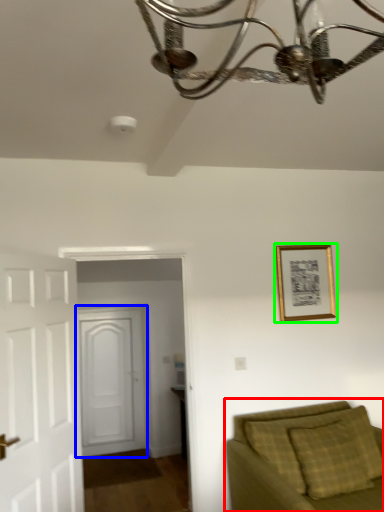
Question: Based on their relative distances, which object is nearer to studio couch (highlighted by a red box)? Choose from door (highlighted by a blue box) and picture frame (highlighted by a green box).

Choices:
 (A) door
 (B) picture frame

Answer: (B)